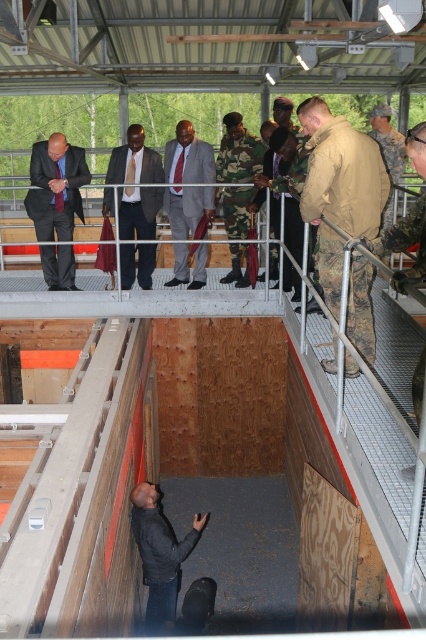
Does matte black suit at left have a greater width compared to matte black suit at center?

Correct, the width of matte black suit at left exceeds that of matte black suit at center.

Who is lower down, matte black suit at left or matte black suit at center?

matte black suit at left

Which is in front, point (80, 172) or point (123, 145)?

Point (80, 172) is in front.

At what (x,y) coordinates should I click in order to perform the action: click on matte black suit at left. Please return your answer as a coordinate pair (x, y). This screenshot has width=426, height=640. Looking at the image, I should click on (55, 188).

Which is more to the right, matte black suit at left or matte gray suit at center?

Positioned to the right is matte gray suit at center.

Does matte black suit at left have a lesser height compared to matte gray suit at center?

Yes.

You are a GUI agent. You are given a task and a screenshot of the screen. Output one action in this format:
    pyautogui.click(x=<x>, y=<y>)
    Task: Click on the matte black suit at left
    
    Given the screenshot: What is the action you would take?
    pyautogui.click(x=55, y=188)

Is point (120, 164) closer to viewer compared to point (203, 204)?

Yes, point (120, 164) is closer to viewer.

Does matte black suit at center appear under matte gray suit at center?

Correct, matte black suit at center is located below matte gray suit at center.

Does point (146, 262) come in front of point (204, 216)?

That is False.

This screenshot has width=426, height=640. Identify the location of matte black suit at center. (135, 182).